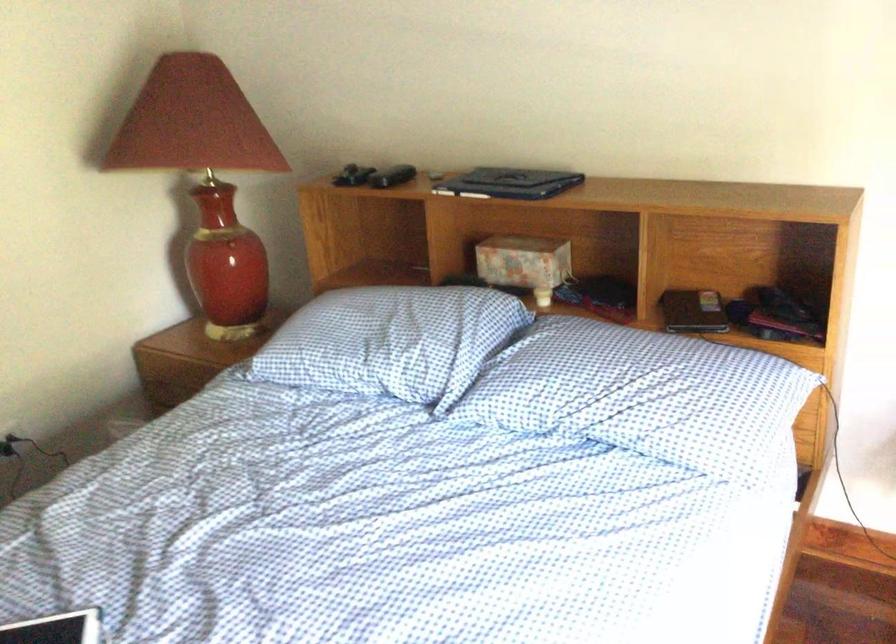
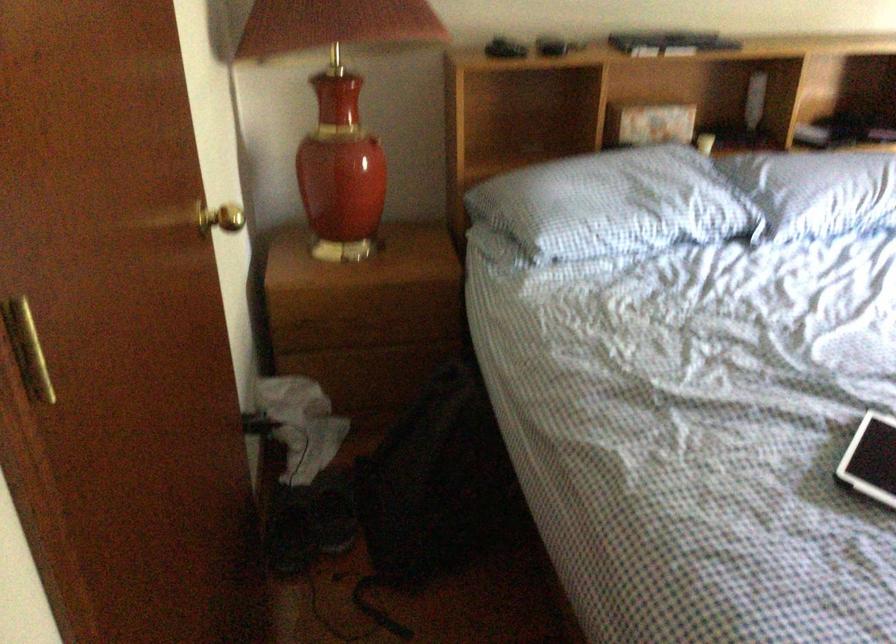
The point at [502,382] is marked in the first image. Where is the corresponding point in the second image?

(817, 191)